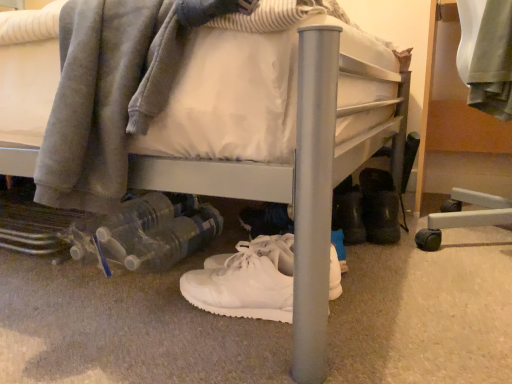
Question: Is point (431, 243) closer or farther from the camera than point (338, 279)?

Choices:
 (A) farther
 (B) closer

Answer: (A)

Question: From a real-world perspective, is brushed metal bed frame at right above or below white leather sneakers at center, positioned as the first footwear in left-to-right order?

Choices:
 (A) below
 (B) above

Answer: (B)

Question: Which is nearer to the brushed metal bed frame at right?

Choices:
 (A) white leather sneakers at center, which ranks as the 1th footwear in front-to-back order
 (B) black rubber boots at lower right, the first footwear from the back

Answer: (B)

Question: Which of these objects is positioned farthest from the black rubber boots at lower right, marked as the 2th footwear in a bottom-to-top arrangement?

Choices:
 (A) white leather sneakers at center, which ranks as the 1th footwear in front-to-back order
 (B) brushed metal bed frame at right

Answer: (A)